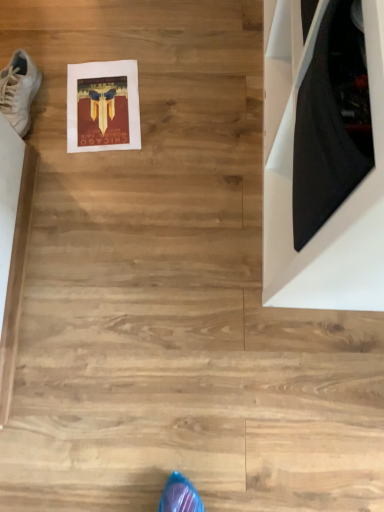
Identify the location of vacant region to the left of black matte cardboard at right. (139, 160).